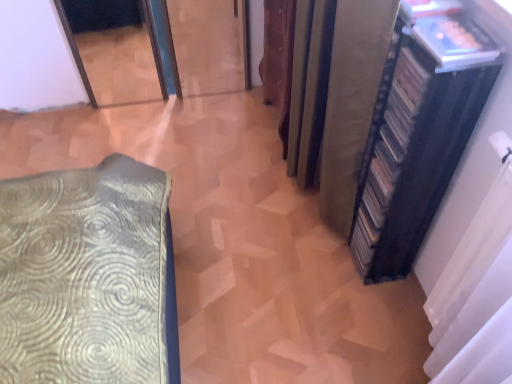
Question: Considering the positions of point (444, 180) and point (441, 28), is point (444, 180) closer or farther from the camera than point (441, 28)?

Choices:
 (A) closer
 (B) farther

Answer: (B)

Question: Which is correct: black matte bookshelf at right is inside translucent plastic book at upper right, or outside of it?

Choices:
 (A) inside
 (B) outside

Answer: (B)

Question: Estimate the real-world distances between objects in this image. Which object is farther from the black matte curtain at right, which appears as the first curtain when viewed from the right?

Choices:
 (A) black matte bookshelf at right
 (B) silky beige curtain at right, marked as the first curtain in a left-to-right arrangement
 (C) translucent plastic book at upper right

Answer: (B)

Question: Which object is positioned farthest from the translucent plastic book at upper right?

Choices:
 (A) black matte bookshelf at right
 (B) silky beige curtain at right, marked as the first curtain in a left-to-right arrangement
 (C) black matte curtain at right, which ranks as the second curtain in left-to-right order

Answer: (C)